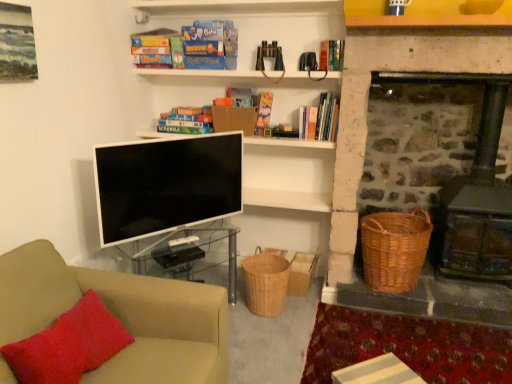
Find the location of a particular element. This screenshot has width=512, height=384. vacant space that is in between woven brown basket at lower center, positioned as the second basket in right-to-left order, and woven brown basket at lower center, the third basket from the right is located at coordinates (298, 305).